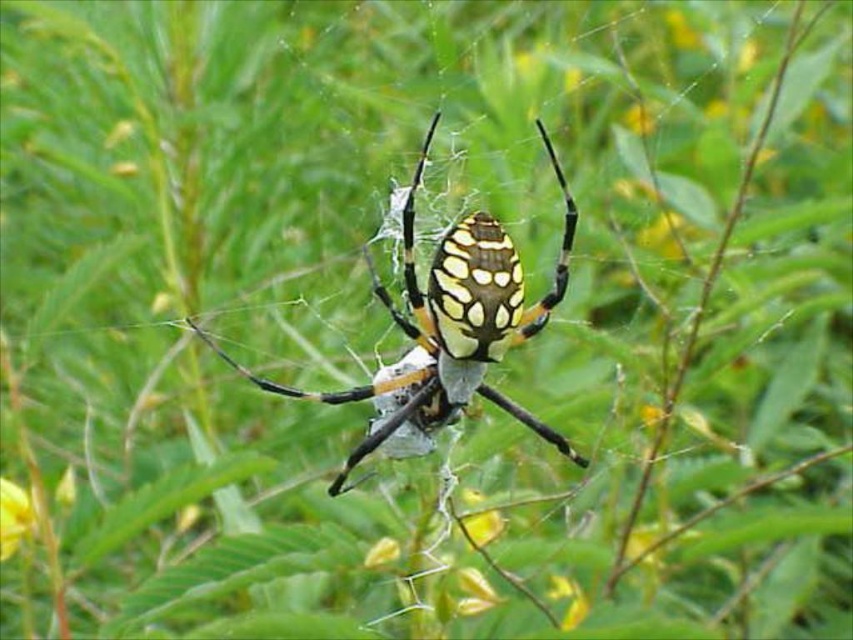
You are an entomologist observing a spider and a flower in a garden. You notice the yellow and black striped spider at center and the yellow matte flower at lower left. Based on their positions, which object is higher up in the image?

The yellow and black striped spider at center is located above the yellow matte flower at lower left, so it is higher up in the image.

You are an entomologist observing a spider web in a garden. You notice the yellow and black striped spider at center. Where is the spider located in terms of its 2D coordinates on the web?

The yellow and black striped spider at center is located at the 2D coordinates point (450,323).